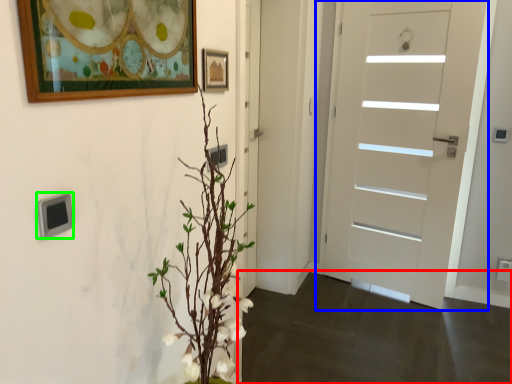
Question: Which object is the closest to the corridor (highlighted by a red box)? Choose among these: door (highlighted by a blue box) or light switch (highlighted by a green box).

Choices:
 (A) door
 (B) light switch

Answer: (A)